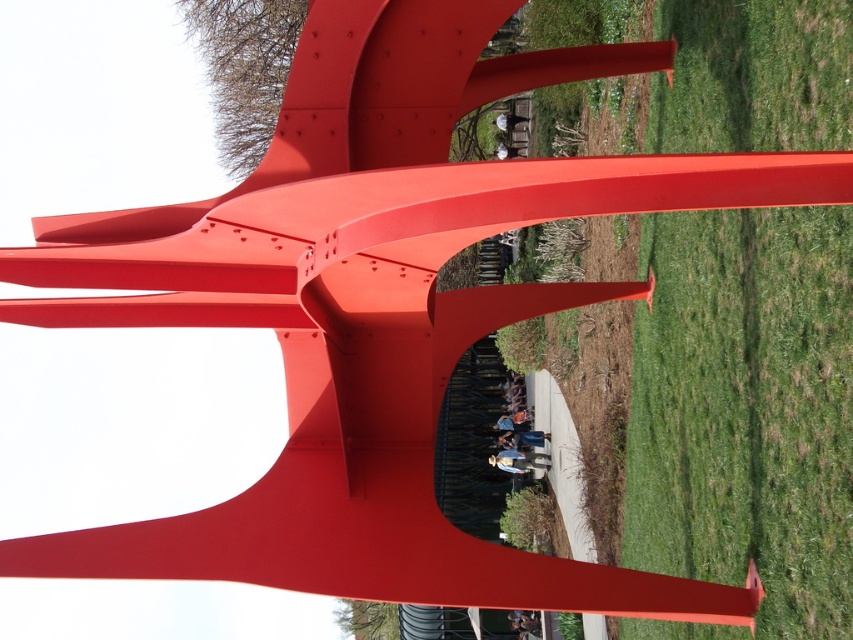
Does green grass at center have a greater width compared to dark blue shirt at center?

No.

This screenshot has height=640, width=853. What are the coordinates of `green grass at center` in the screenshot? It's located at (746, 410).